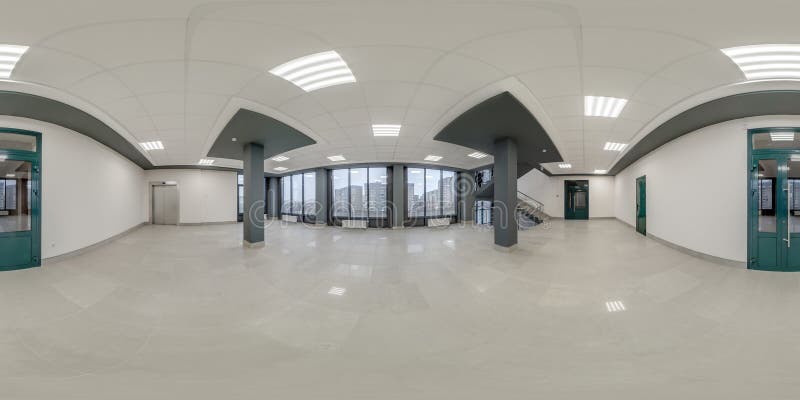
I want to click on doors, so click(x=18, y=218), click(x=777, y=213).